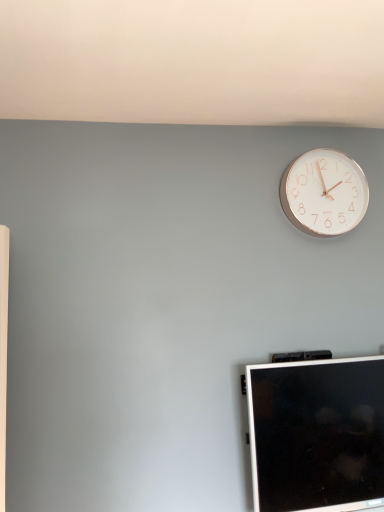
Question: Considering their positions, is white metallic clock at upper right located in front of or behind black glossy monitor at lower right?

Choices:
 (A) front
 (B) behind

Answer: (B)

Question: Which is correct: white metallic clock at upper right is inside black glossy monitor at lower right, or outside of it?

Choices:
 (A) inside
 (B) outside

Answer: (B)

Question: Considering the positions of white metallic clock at upper right and black glossy monitor at lower right in the image, is white metallic clock at upper right taller or shorter than black glossy monitor at lower right?

Choices:
 (A) tall
 (B) short

Answer: (B)

Question: From the image's perspective, is black glossy monitor at lower right positioned above or below white metallic clock at upper right?

Choices:
 (A) above
 (B) below

Answer: (B)

Question: Considering the positions of black glossy monitor at lower right and white metallic clock at upper right in the image, is black glossy monitor at lower right taller or shorter than white metallic clock at upper right?

Choices:
 (A) tall
 (B) short

Answer: (A)

Question: Is point (258, 452) closer or farther from the camera than point (321, 163)?

Choices:
 (A) farther
 (B) closer

Answer: (B)

Question: From a real-world perspective, is black glossy monitor at lower right above or below white metallic clock at upper right?

Choices:
 (A) above
 (B) below

Answer: (B)